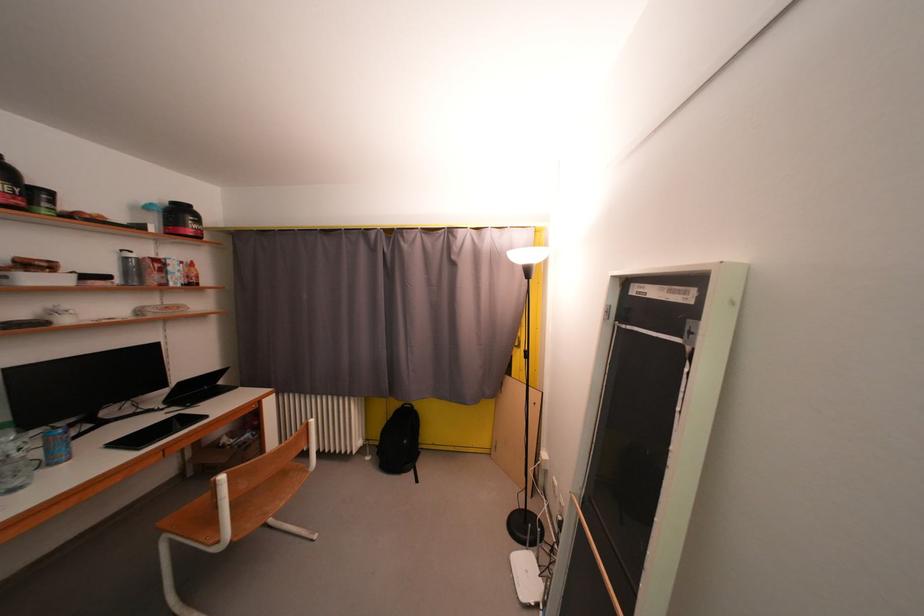
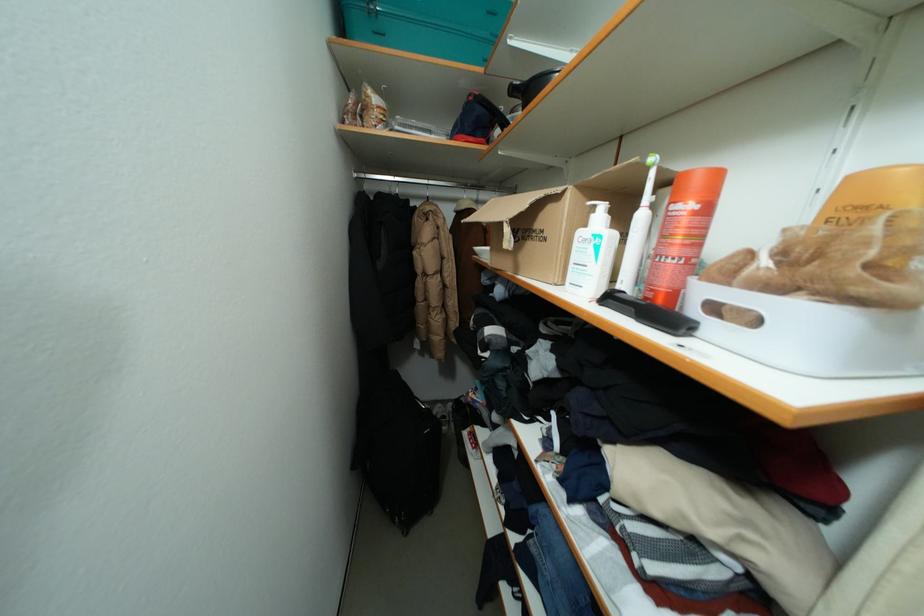
Question: I am providing you with two images of the same scene from different viewpoints. Please identify which objects are invisible in image2.

Choices:
 (A) wire mesh basket
 (B) black laptop
 (C) cardboard box
 (D) hanger hook

Answer: (B)